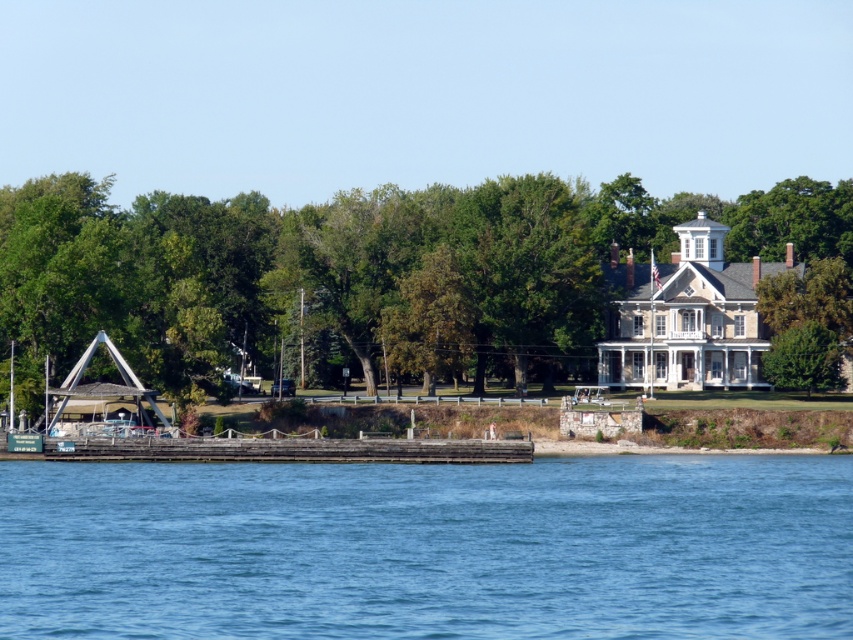
You are standing on the wooden dock at lower center and want to look up at the green leafy tree at center. In which direction should you look?

You should look upward because the wooden dock at lower center is below the green leafy tree at center.

You are standing on the wooden dock at lower center and want to look towards the green leafy tree at upper center. Which direction should you face?

Since the green leafy tree at upper center is further to the viewer than the wooden dock at lower center, you should face towards the tree to look in the direction it is located closer to you.

You are planning to take a photo of the green leafy tree at upper center and the green leafy tree at center from the dock. Which tree would appear wider in the photo?

The green leafy tree at upper center would appear wider in the photo because its width is larger than the green leafy tree at center.